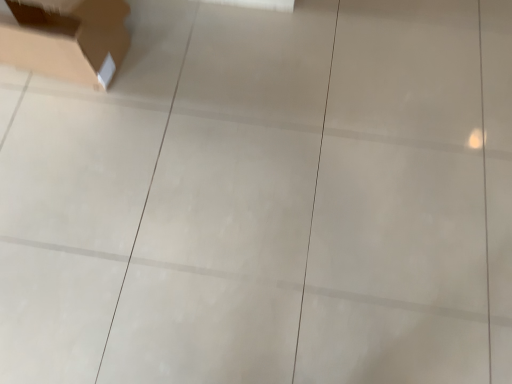
Measure the distance between brown cardboard box at upper left and camera.

brown cardboard box at upper left and camera are 1.22 meters apart from each other.

This screenshot has height=384, width=512. In order to click on brown cardboard box at upper left in this screenshot , I will do `click(67, 40)`.

The image size is (512, 384). Describe the element at coordinates (67, 40) in the screenshot. I see `brown cardboard box at upper left` at that location.

Image resolution: width=512 pixels, height=384 pixels. Find the location of `brown cardboard box at upper left`. brown cardboard box at upper left is located at coordinates (67, 40).